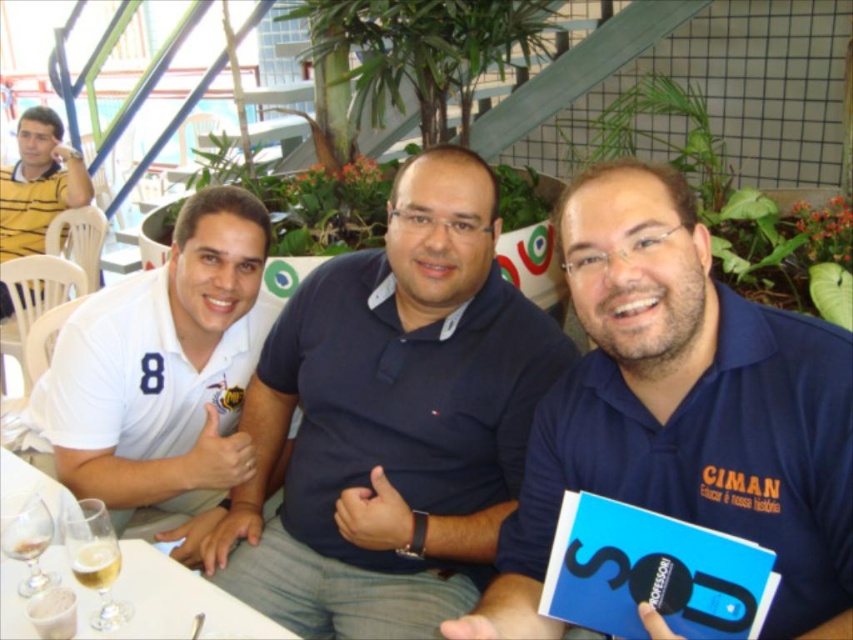
Who is higher up, blue cotton shirt at center or white glossy table at lower left?

Positioned higher is blue cotton shirt at center.

Locate an element on the screen. The image size is (853, 640). blue cotton shirt at center is located at coordinates (392, 420).

Is point (351, 262) positioned after point (128, 621)?

Yes, it is behind point (128, 621).

Find the location of a particular element. blue cotton shirt at center is located at coordinates (392, 420).

Which is more to the left, white glossy table at lower left or yellow striped shirt at upper left?

Positioned to the left is yellow striped shirt at upper left.

Describe the element at coordinates (163, 600) in the screenshot. The height and width of the screenshot is (640, 853). I see `white glossy table at lower left` at that location.

Locate an element on the screen. This screenshot has height=640, width=853. white glossy table at lower left is located at coordinates (163, 600).

Does point (364, 573) come in front of point (76, 419)?

Yes, point (364, 573) is closer to viewer.

Between blue cotton shirt at center and white matte polo shirt at left, which one is positioned higher?

white matte polo shirt at left is higher up.

Does point (234, 524) lie in front of point (252, 275)?

Yes, point (234, 524) is in front of point (252, 275).

You are a GUI agent. You are given a task and a screenshot of the screen. Output one action in this format:
    pyautogui.click(x=<x>, y=<y>)
    Task: Click on the blue cotton shirt at center
    Image resolution: width=853 pixels, height=640 pixels.
    Given the screenshot: What is the action you would take?
    pyautogui.click(x=392, y=420)